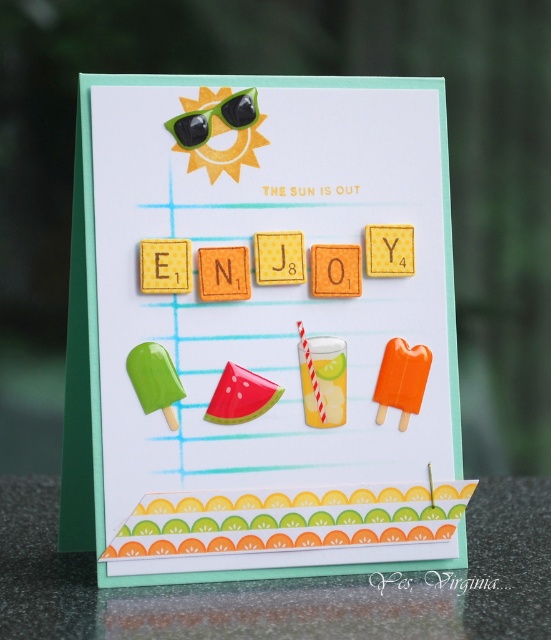
Find the location of a particular element. The image size is (551, 640). green paper at lower center is located at coordinates (283, 582).

Can you confirm if green paper at lower center is shorter than green matte sunglasses at upper center?

Yes.

Does point (457, 618) come in front of point (181, 131)?

That is True.

Find the location of a particular element. green paper at lower center is located at coordinates (283, 582).